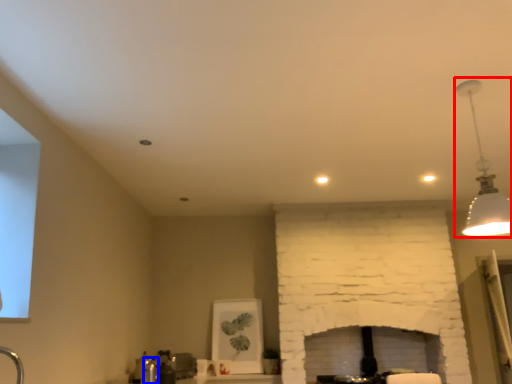
Question: Which point is closer to the camera, lamp (highlighted by a red box) or faucet (highlighted by a blue box)?

Choices:
 (A) lamp
 (B) faucet

Answer: (A)